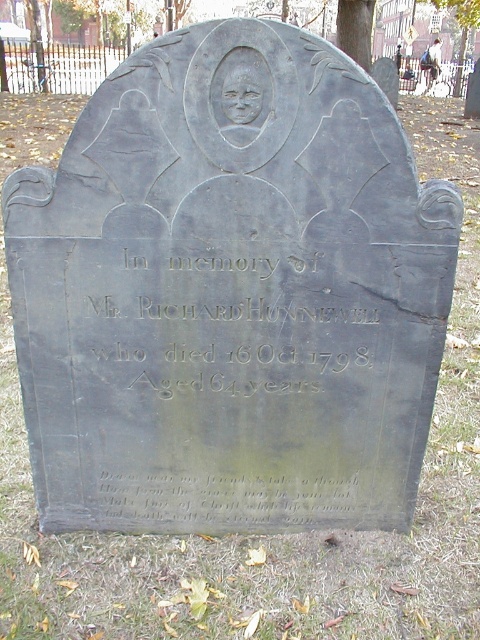
Question: Among these points, which one is nearest to the camera?

Choices:
 (A) (346, 348)
 (B) (344, 492)

Answer: (A)

Question: Which point appears farthest from the camera in this image?

Choices:
 (A) (276, 272)
 (B) (118, 499)

Answer: (B)

Question: Is black stone plaque at center to the left of black stone inscription at lower center from the viewer's perspective?

Choices:
 (A) no
 (B) yes

Answer: (A)

Question: Is black stone plaque at center above black stone inscription at lower center?

Choices:
 (A) no
 (B) yes

Answer: (B)

Question: Does black stone plaque at center have a lesser width compared to black stone inscription at lower center?

Choices:
 (A) no
 (B) yes

Answer: (B)